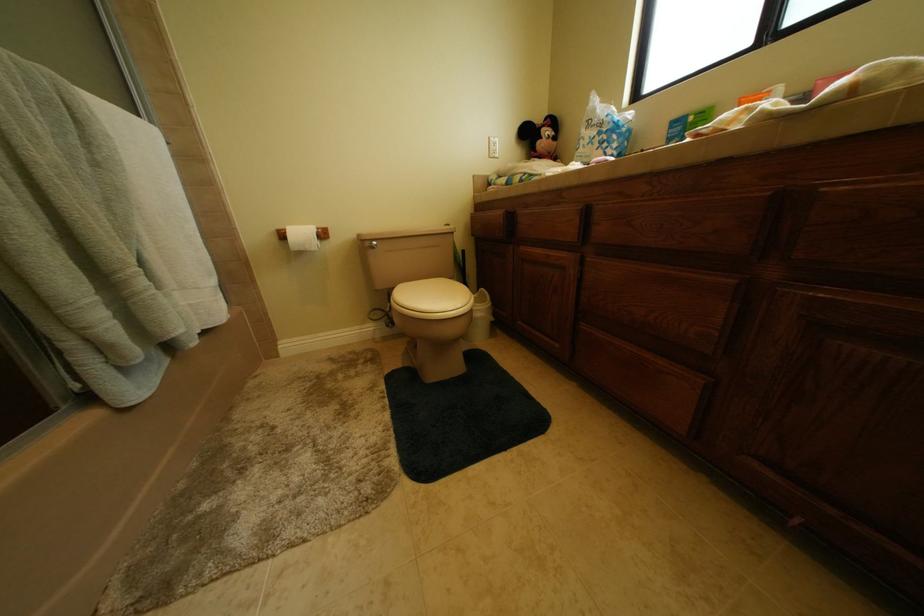
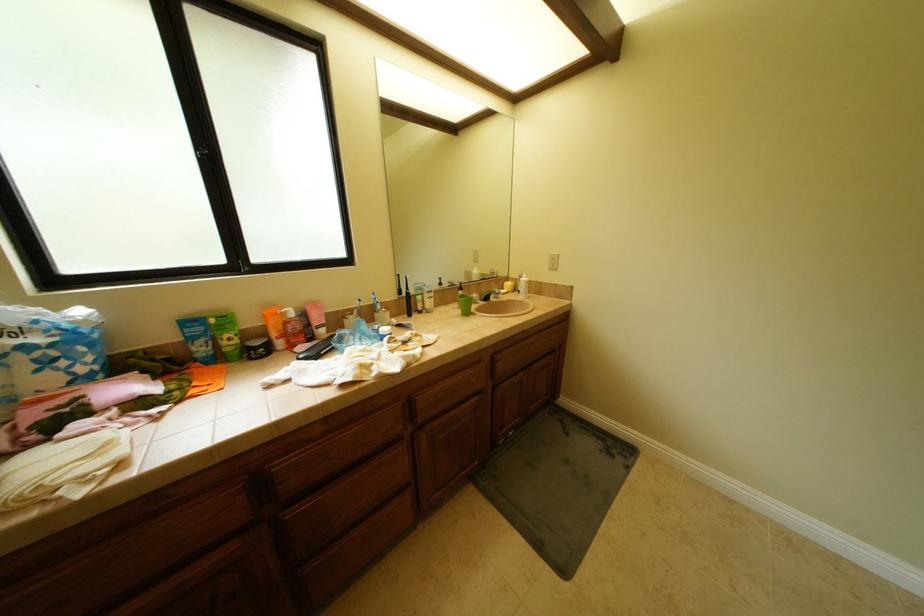
Based on the continuous images, in which direction is the camera rotating?

The camera's rotation is toward right-down.